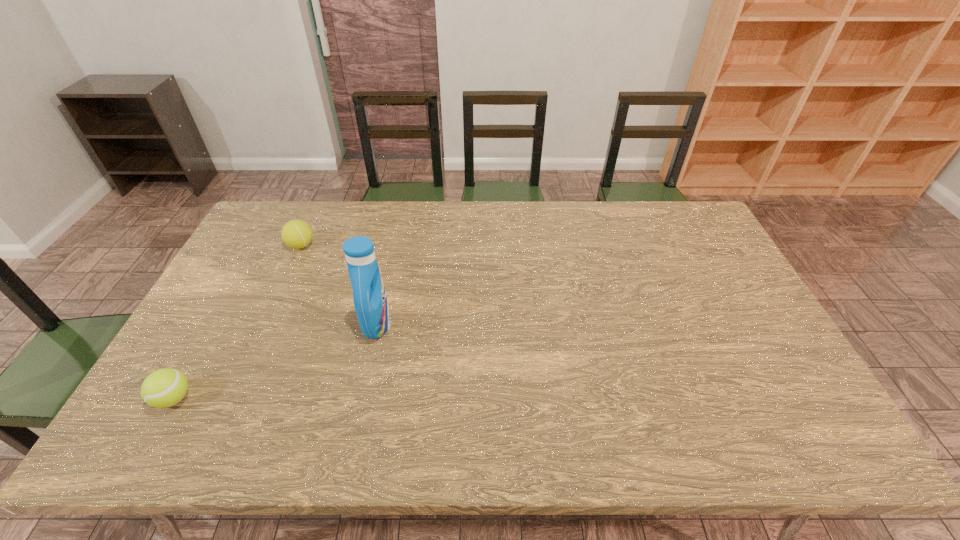
I want to click on unoccupied position between the second object from right to left and the left tennis ball, so click(237, 322).

Where is `vacant area between the tallest object and the leftmost object`? vacant area between the tallest object and the leftmost object is located at coordinates (276, 361).

Locate an element on the screen. Image resolution: width=960 pixels, height=540 pixels. free space between the second farthest object and the nearest object is located at coordinates (276, 361).

Find the location of a particular element. vacant region between the rightmost object and the nearer tennis ball is located at coordinates [276, 361].

Locate an element on the screen. vacant point located between the farther tennis ball and the leftmost object is located at coordinates (237, 322).

Where is `free space between the nearer tennis ball and the tallest object`? The height and width of the screenshot is (540, 960). free space between the nearer tennis ball and the tallest object is located at coordinates (276, 361).

The height and width of the screenshot is (540, 960). What are the coordinates of `free area in between the right tennis ball and the second farthest object` in the screenshot? It's located at (339, 285).

Identify which object is located as the second nearest to the second farthest object. Please provide its 2D coordinates. Your answer should be formatted as a tuple, i.e. [(x, y)], where the tuple contains the x and y coordinates of a point satisfying the conditions above.

[(165, 387)]

This screenshot has height=540, width=960. I want to click on object that is the second closest to the detergent, so click(165, 387).